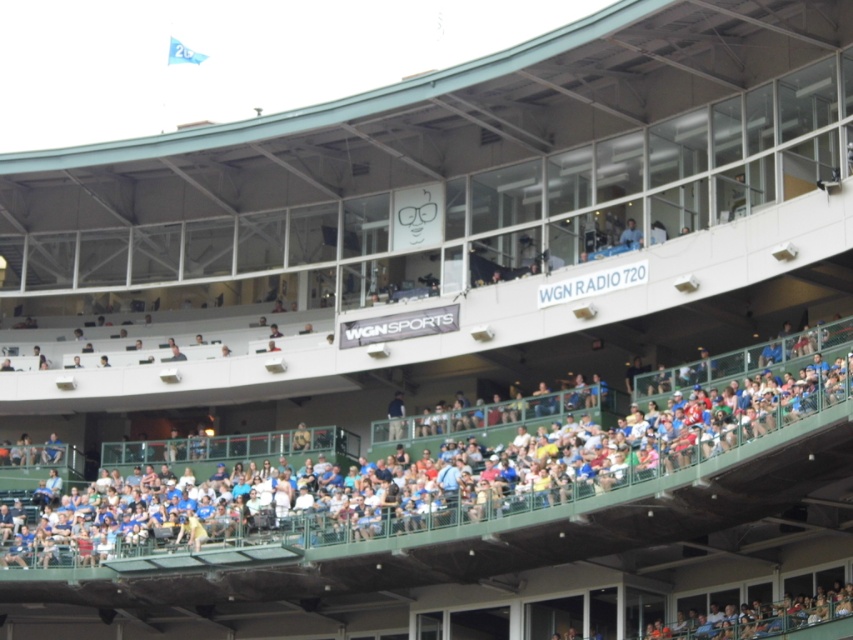
Question: Among these points, which one is farthest from the camera?

Choices:
 (A) (273, 512)
 (B) (635, 241)

Answer: (B)

Question: Can you confirm if green plastic seats at center is positioned above blue shirt at upper center?

Choices:
 (A) yes
 (B) no

Answer: (B)

Question: Which point appears farthest from the camera in this image?

Choices:
 (A) (151, 512)
 (B) (624, 241)

Answer: (A)

Question: Does green plastic seats at center have a smaller size compared to blue shirt at upper center?

Choices:
 (A) yes
 (B) no

Answer: (B)

Question: Is green plastic seats at center thinner than blue shirt at upper center?

Choices:
 (A) no
 (B) yes

Answer: (A)